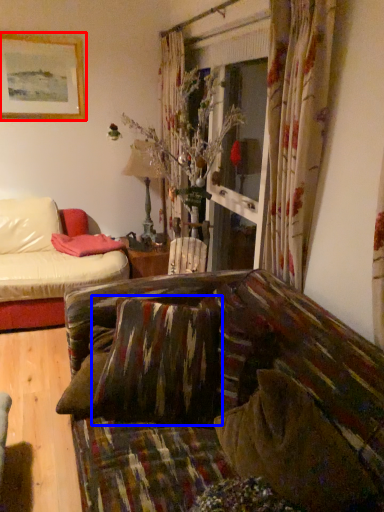
Question: Which of the following is the farthest to the observer, picture frame (highlighted by a red box) or pillow (highlighted by a blue box)?

Choices:
 (A) picture frame
 (B) pillow

Answer: (A)